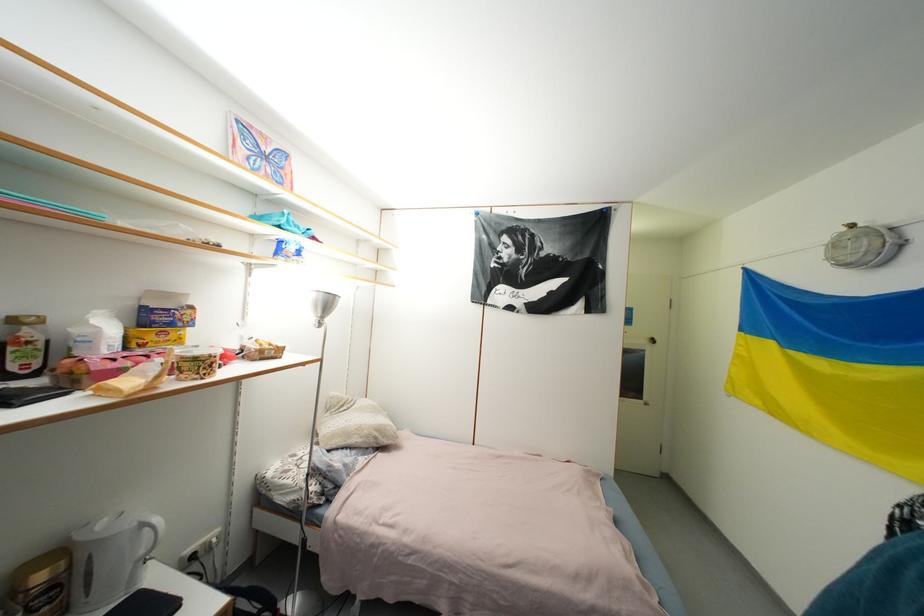
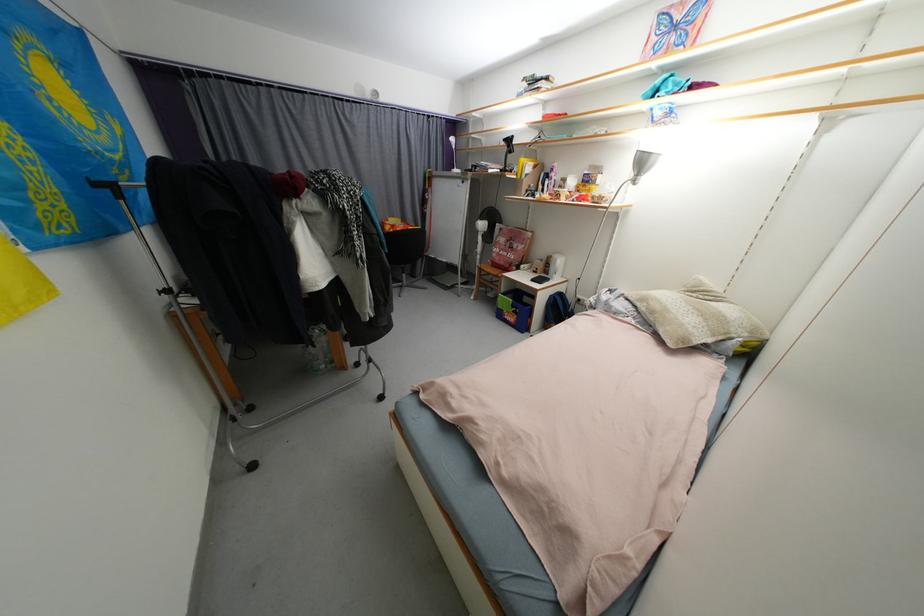
Find the pixel in the second image that matches (65,554) in the first image.

(557, 257)